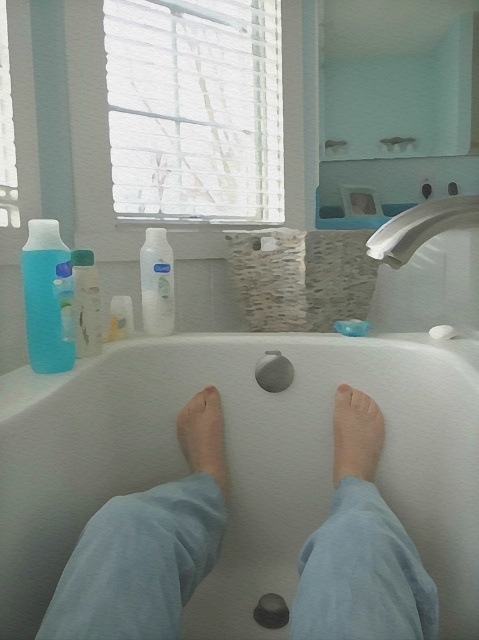
You are trying to decide which item to grab first from the bathtub edge. Based on their sizes, which one do you think is wider, the transparent plastic bottle at left or the translucent plastic soap at center?

The transparent plastic bottle at left is wider than the translucent plastic soap at center according to the description.